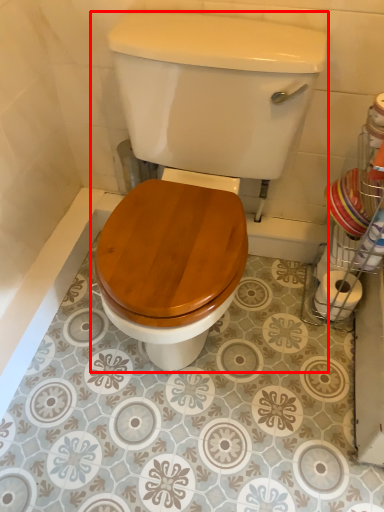
Question: Where is toilet (annotated by the red box) located in relation to toilet paper in the image?

Choices:
 (A) left
 (B) right

Answer: (A)